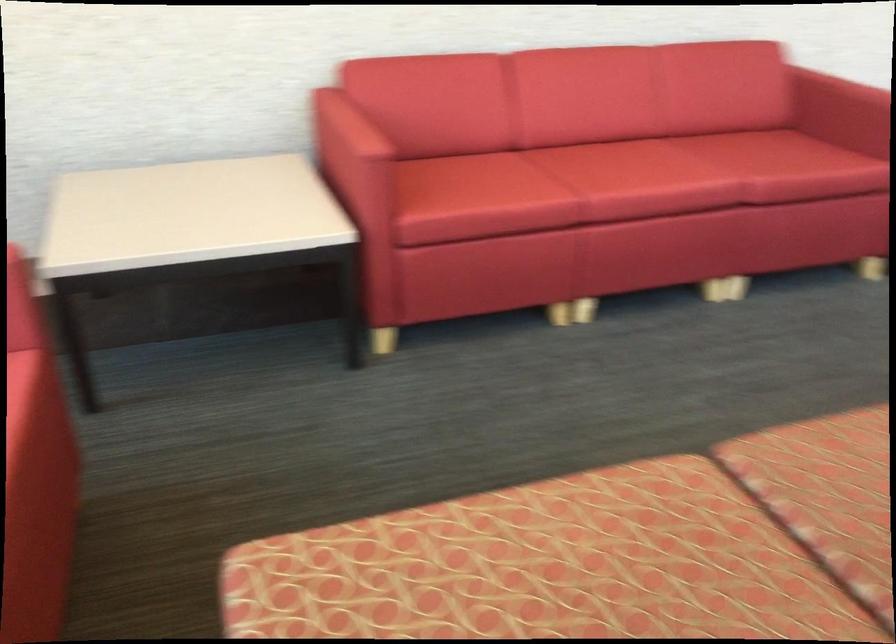
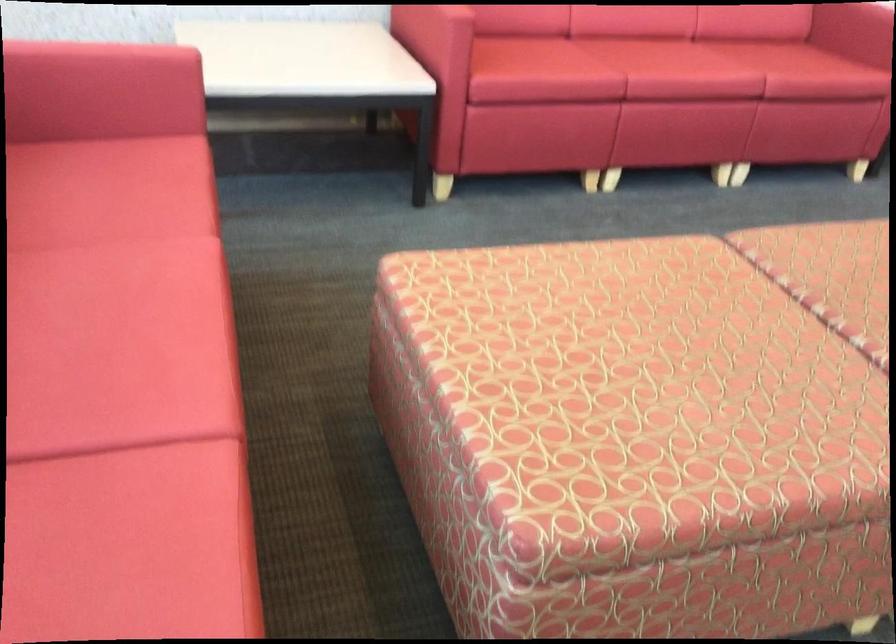
Where in the second image is the point corresponding to point (643, 172) from the first image?

(677, 62)